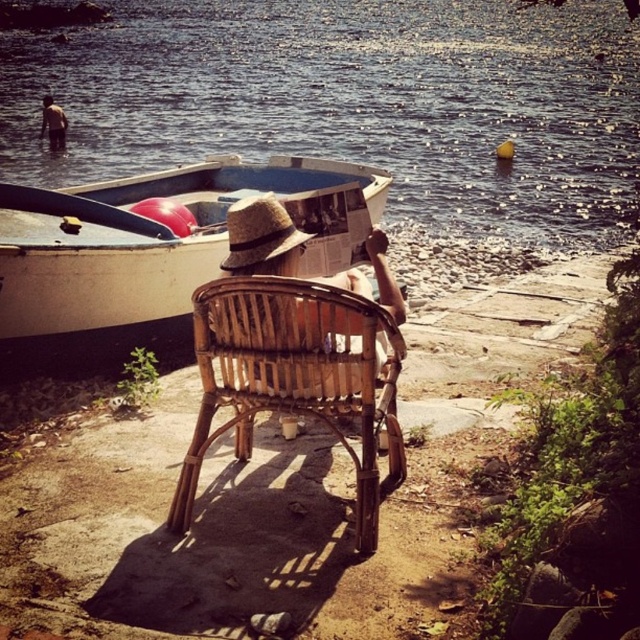
You are a photographer wanting to capture the entire scene in one shot. Given that the blue water at center and the white matte boat at center are both in the frame, which object will occupy more space in the photo?

The blue water at center will occupy more space in the photo because it is bigger than the white matte boat at center according to the description.

You are a photographer positioned at the center of the scene. You want to capture a photo that includes both the white matte boat at center and the brown leather jacket at upper left. Which direction should you move to ensure both objects are in frame?

You should move to the left to ensure both the white matte boat at center and the brown leather jacket at upper left are in frame since the boat is to the right of the jacket.